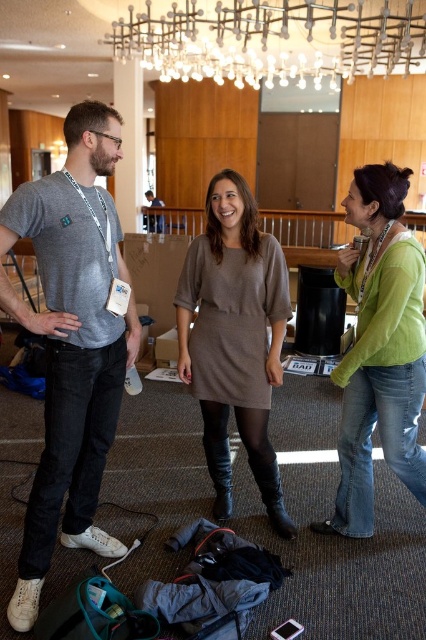
Is matte brown dress at center shorter than dark gray fabric shirt at center?

Incorrect, matte brown dress at center's height does not fall short of dark gray fabric shirt at center's.

Is matte brown dress at center to the left of dark gray fabric shirt at center from the viewer's perspective?

Incorrect, matte brown dress at center is not on the left side of dark gray fabric shirt at center.

Which is in front, point (213, 225) or point (157, 204)?

Point (213, 225) is in front.

At what (x,y) coordinates should I click in order to perform the action: click on matte brown dress at center. Please return your answer as a coordinate pair (x, y). The height and width of the screenshot is (640, 426). Looking at the image, I should click on (235, 339).

Is point (65, 284) closer to camera compared to point (348, 509)?

Yes.

Is matte gray t-shirt at center positioned before green knitwear at center?

Yes.

Is point (97, 154) in front of point (357, 410)?

Yes, it is.

Identify the location of matte gray t-shirt at center. (71, 342).

How much distance is there between matte gray t-shirt at center and dark gray fabric shirt at center?

18.89 feet

Which is in front, point (94, 380) or point (146, 225)?

Point (94, 380) is in front.

Which is in front, point (85, 218) or point (154, 204)?

Point (85, 218) is more forward.

Image resolution: width=426 pixels, height=640 pixels. In order to click on matte gray t-shirt at center in this screenshot , I will do `click(71, 342)`.